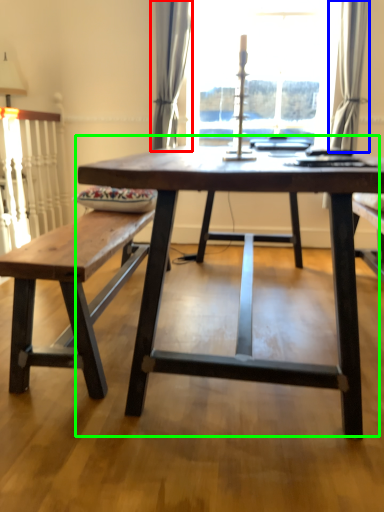
Question: Which is farther away from curtain (highlighted by a red box)? curtain (highlighted by a blue box) or coffee table (highlighted by a green box)?

Choices:
 (A) curtain
 (B) coffee table

Answer: (B)